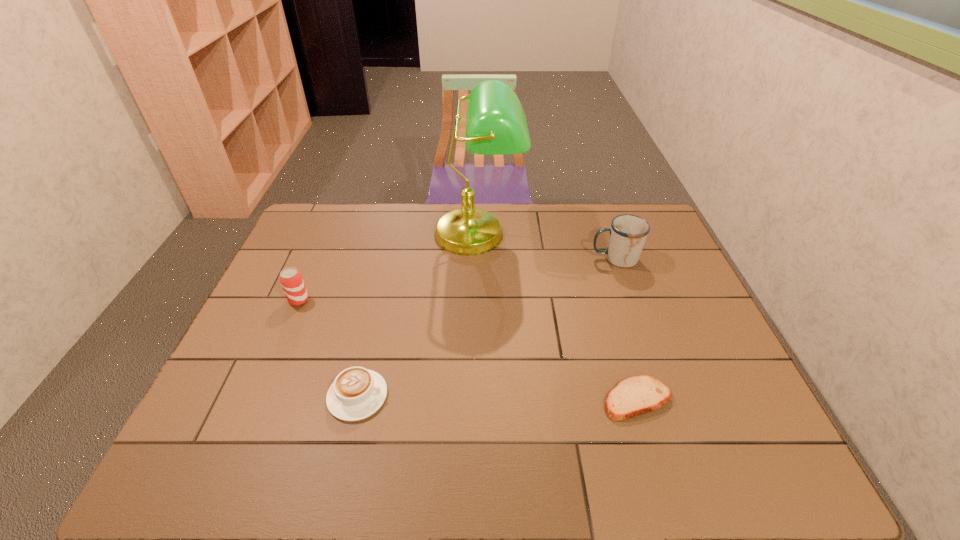
Locate an element on the screen. This screenshot has width=960, height=540. lamp is located at coordinates (496, 124).

I want to click on the third object from left to right, so click(496, 124).

In order to click on mug in this screenshot , I will do `click(628, 233)`.

Find the location of `beer can`. beer can is located at coordinates (291, 280).

At what (x,y) coordinates should I click in order to perform the action: click on the third nearest object. Please return your answer as a coordinate pair (x, y). Looking at the image, I should click on (291, 280).

Where is `the second shortest object`? the second shortest object is located at coordinates (356, 393).

This screenshot has height=540, width=960. What are the coordinates of `the fourth object from right to left` in the screenshot? It's located at (356, 393).

Where is `the shortest object`? the shortest object is located at coordinates (637, 395).

At what (x,y) coordinates should I click in order to perform the action: click on vacant point located 0.240m on the desk next to the third object from right to left. Please return your answer as a coordinate pair (x, y). Image resolution: width=960 pixels, height=540 pixels. Looking at the image, I should click on (477, 322).

This screenshot has width=960, height=540. In order to click on blank space located on the handle side of the mug in this screenshot , I will do `click(544, 259)`.